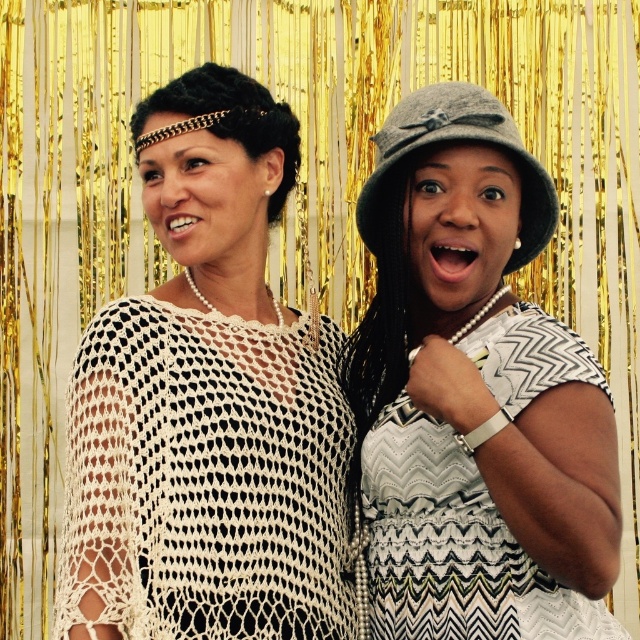
You are standing at the back of the image and want to reach both the white crochet top at center and the gray felt hat at upper center. Which object is closer to you?

The white crochet top at center is closer to you since it is 6.28 feet away from the gray felt hat at upper center, meaning the white crochet top is nearer than the gray felt hat.

Looking at this image, you are a photographer adjusting your camera settings to capture both the gray felt hat at center and the gray felt hat at upper center. Which hat should you focus on first to ensure both are in sharp focus?

The gray felt hat at center is closer to the viewer than the gray felt hat at upper center, so you should focus on the gray felt hat at center first to ensure both are in sharp focus.

You are a photographer setting up for a photo shoot. You notice two gray felt hats in the scene. Which hat is closer to the camera, the gray felt hat at center or the gray felt hat at upper center?

The gray felt hat at upper center is closer to the camera because it is positioned above the gray felt hat at center, which is placed underneath it.